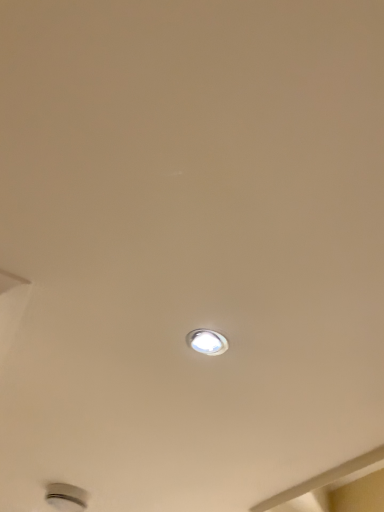
The height and width of the screenshot is (512, 384). What are the coordinates of `metallic silver lamp at bottom left` in the screenshot? It's located at (66, 497).

Image resolution: width=384 pixels, height=512 pixels. Describe the element at coordinates (66, 497) in the screenshot. I see `metallic silver lamp at bottom left` at that location.

Locate an element on the screen. This screenshot has height=512, width=384. metallic silver lamp at bottom left is located at coordinates 66,497.